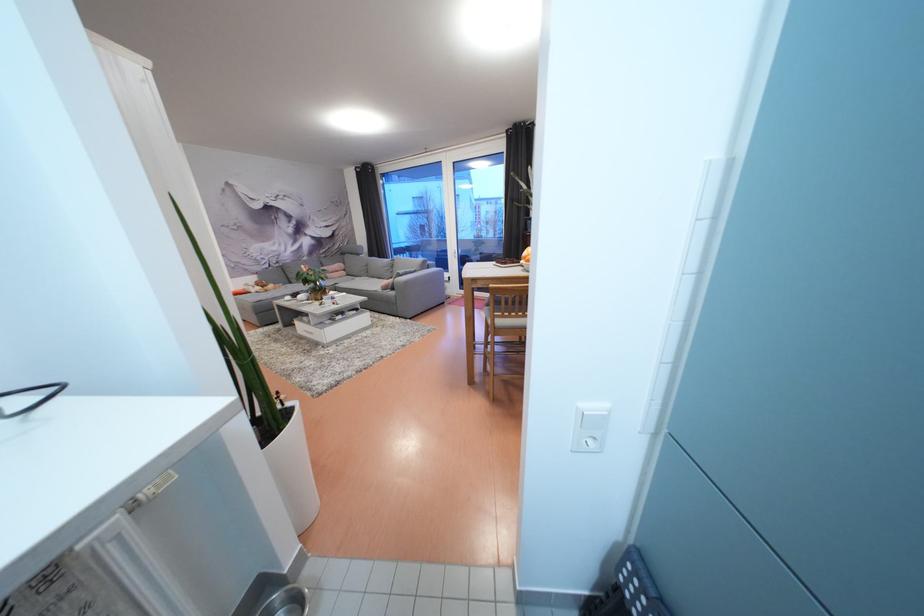
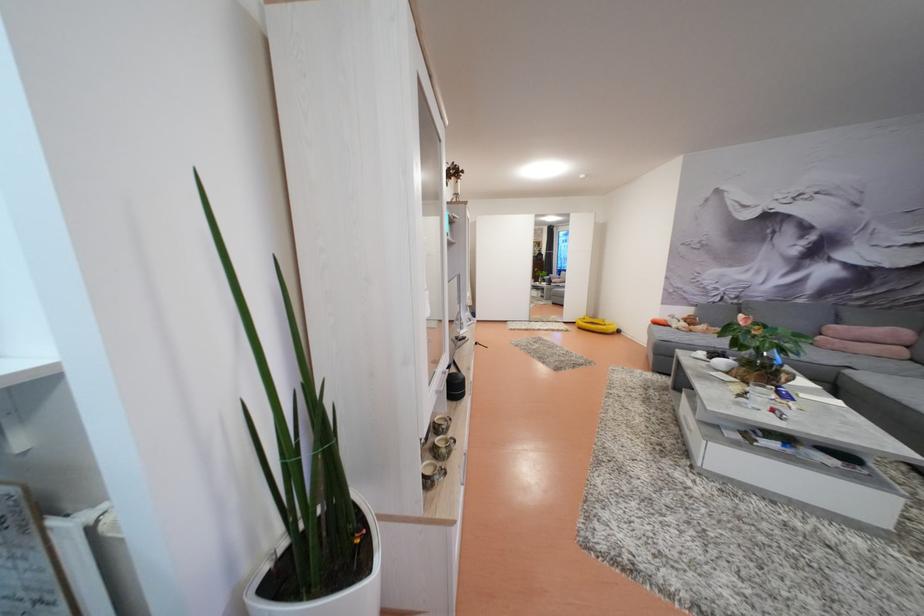
Find the pixel in the second image that matches point 312,304 in the first image.

(731, 374)